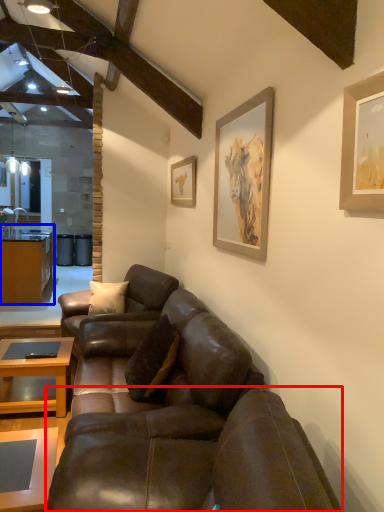
Question: Which point is further to the camera, studio couch (highlighted by a red box) or cabinetry (highlighted by a blue box)?

Choices:
 (A) studio couch
 (B) cabinetry

Answer: (B)